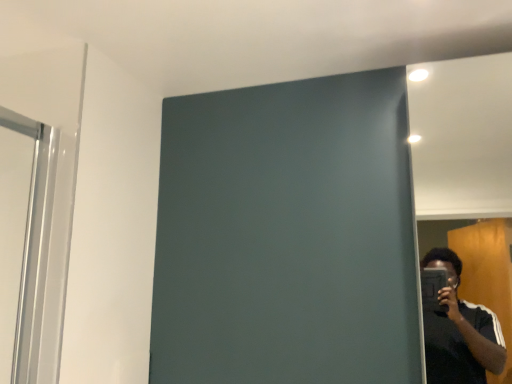
Describe the element at coordinates (463, 136) in the screenshot. I see `white glossy mirror at right` at that location.

Find the location of a particular element. Image resolution: width=512 pixels, height=384 pixels. white glossy mirror at right is located at coordinates (463, 136).

I want to click on white glossy mirror at right, so click(x=463, y=136).